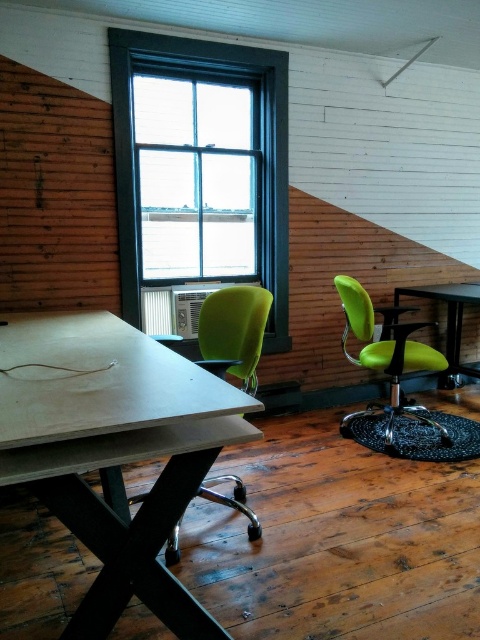
Question: Which object is closer to the camera taking this photo?

Choices:
 (A) matte black table at center
 (B) matte green swivel chair at right
 (C) matte white table at center

Answer: (C)

Question: Does matte white table at center come in front of blue painted wood window at upper center?

Choices:
 (A) yes
 (B) no

Answer: (A)

Question: Can you confirm if matte green swivel chair at right is smaller than matte black table at center?

Choices:
 (A) yes
 (B) no

Answer: (A)

Question: Which point is closer to the camera taking this photo?

Choices:
 (A) (256, 401)
 (B) (266, 115)

Answer: (A)

Question: Does matte green swivel chair at right have a smaller size compared to matte black table at center?

Choices:
 (A) no
 (B) yes

Answer: (B)

Question: Among these points, which one is farthest from the camera?

Choices:
 (A) (402, 410)
 (B) (142, 340)
 (C) (116, 61)

Answer: (A)